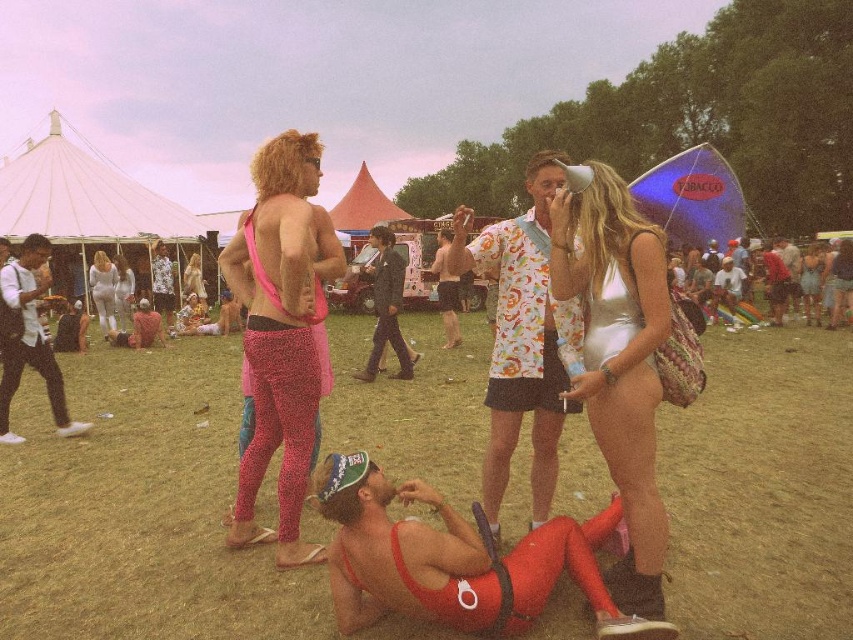
Is printed cotton shirt at center shorter than white cotton shirt at left?

Yes, printed cotton shirt at center is shorter than white cotton shirt at left.

Locate an element on the screen. printed cotton shirt at center is located at coordinates (523, 339).

Where is `printed cotton shirt at center`? This screenshot has width=853, height=640. printed cotton shirt at center is located at coordinates (523, 339).

Can you confirm if matte red bikini top at lower center is positioned above neon pink spandex pants at center?

Actually, matte red bikini top at lower center is below neon pink spandex pants at center.

Which is more to the right, matte red bikini top at lower center or neon pink spandex pants at center?

From the viewer's perspective, matte red bikini top at lower center appears more on the right side.

I want to click on matte red bikini top at lower center, so click(453, 561).

Between neon pink spandex pants at center and silver metallic bodysuit at center, which one appears on the left side from the viewer's perspective?

From the viewer's perspective, silver metallic bodysuit at center appears more on the left side.

Is neon pink spandex pants at center above silver metallic bodysuit at center?

Yes.

Is point (154, 272) farther from camera compared to point (125, 307)?

Yes, it is.

Identify the location of neon pink spandex pants at center. The image size is (853, 640). (161, 282).